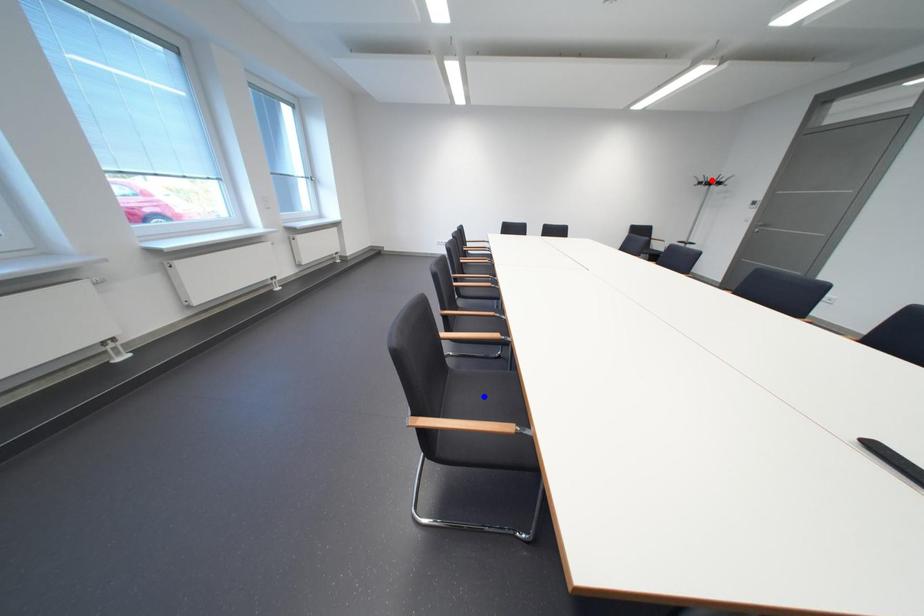
Question: In the image, two points are highlighted. Which point is nearer to the camera? Reply with the corresponding letter.

Choices:
 (A) blue point
 (B) red point

Answer: (A)